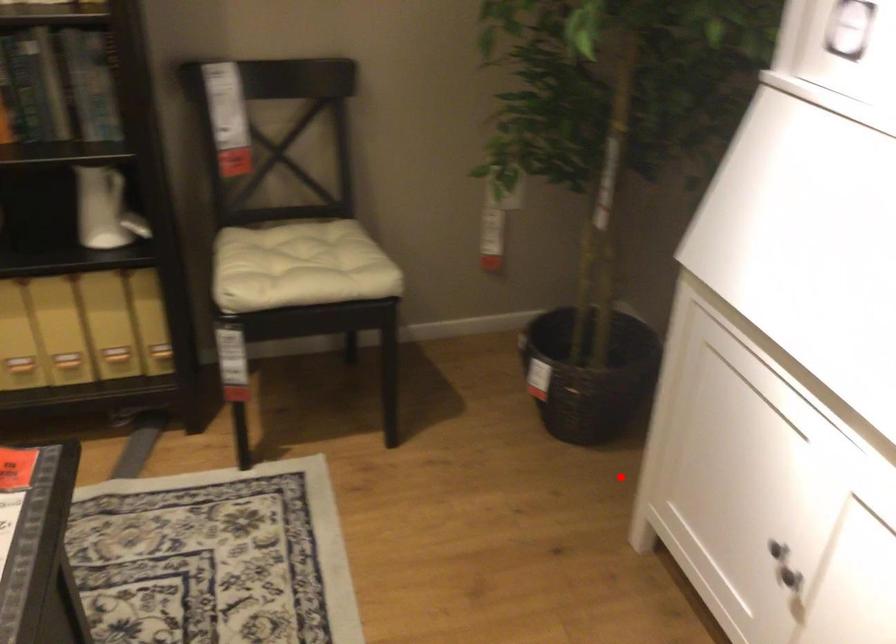
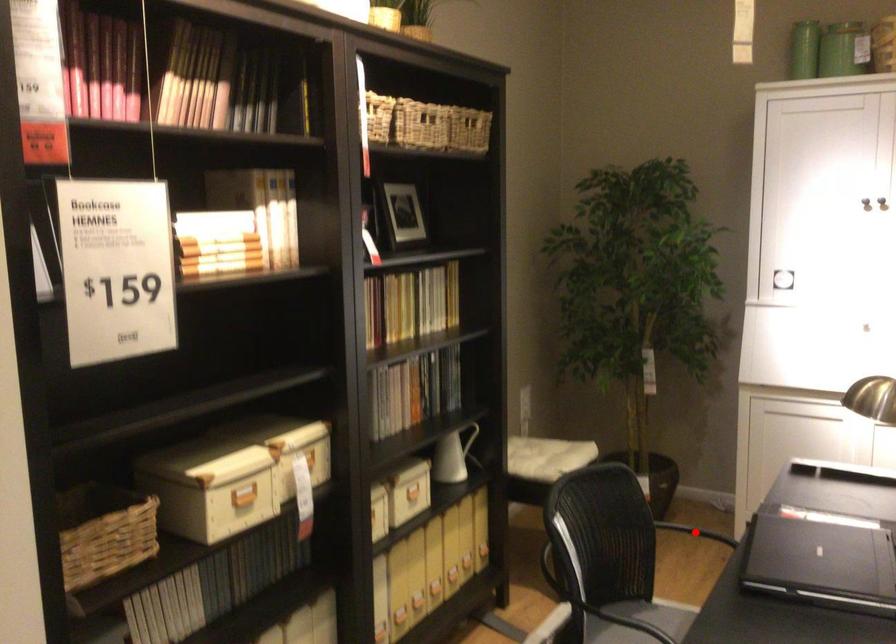
I am providing you with two images of the same scene from different viewpoints. A red point is marked on the first image and another point is marked on the second image. Do the highlighted points in image1 and image2 indicate the same real-world spot?

Yes